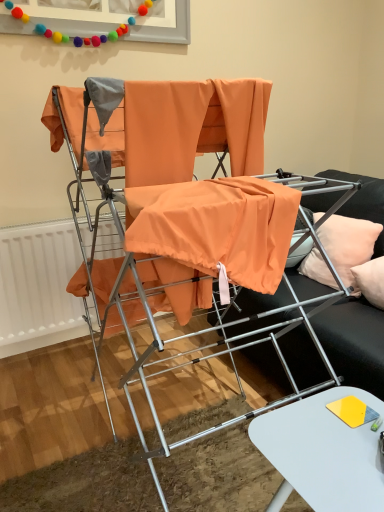
Question: Does white glossy table at lower right have a larger size compared to peach fabric pillow at right?

Choices:
 (A) no
 (B) yes

Answer: (B)

Question: Is white glossy table at lower right not near peach fabric pillow at right?

Choices:
 (A) no
 (B) yes

Answer: (A)

Question: From a real-world perspective, is white glossy table at lower right over peach fabric pillow at right?

Choices:
 (A) yes
 (B) no

Answer: (B)

Question: Is white glossy table at lower right positioned behind peach fabric pillow at right?

Choices:
 (A) no
 (B) yes

Answer: (A)

Question: Is white glossy table at lower right completely or partially outside of peach fabric pillow at right?

Choices:
 (A) yes
 (B) no

Answer: (A)

Question: Does point tap(79, 108) appear closer or farther from the camera than point tap(281, 490)?

Choices:
 (A) farther
 (B) closer

Answer: (A)

Question: Looking at the image, does orange fabric at center seem bigger or smaller compared to white glossy table at lower right?

Choices:
 (A) small
 (B) big

Answer: (B)

Question: From a real-world perspective, is orange fabric at center physically located above or below white glossy table at lower right?

Choices:
 (A) above
 (B) below

Answer: (A)

Question: From the image's perspective, relative to white glossy table at lower right, is orange fabric at center above or below?

Choices:
 (A) below
 (B) above

Answer: (B)

Question: In the image, is white glossy table at lower right positioned in front of or behind orange fabric at center?

Choices:
 (A) behind
 (B) front

Answer: (B)

Question: From a real-world perspective, is white glossy table at lower right positioned above or below orange fabric at center?

Choices:
 (A) below
 (B) above

Answer: (A)

Question: Is white glossy table at lower right wider or thinner than orange fabric at center?

Choices:
 (A) thin
 (B) wide

Answer: (A)

Question: In terms of height, does white glossy table at lower right look taller or shorter compared to orange fabric at center?

Choices:
 (A) tall
 (B) short

Answer: (B)

Question: From a real-world perspective, is peach fabric pillow at right above or below orange fabric at center?

Choices:
 (A) below
 (B) above

Answer: (B)

Question: Considering the relative positions of peach fabric pillow at right and orange fabric at center in the image provided, is peach fabric pillow at right to the left or to the right of orange fabric at center?

Choices:
 (A) right
 (B) left

Answer: (A)